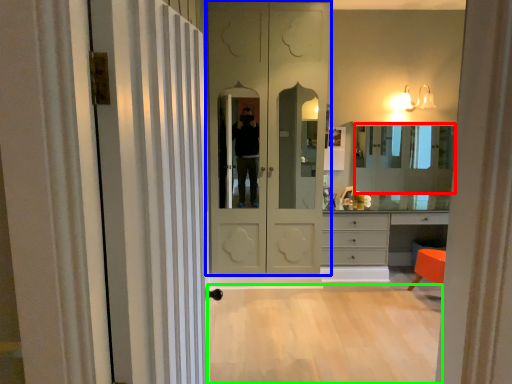
Question: Estimate the real-world distances between objects in this image. Which object is farther from mirror (highlighted by a red box), door (highlighted by a blue box) or plain (highlighted by a green box)?

Choices:
 (A) door
 (B) plain

Answer: (B)